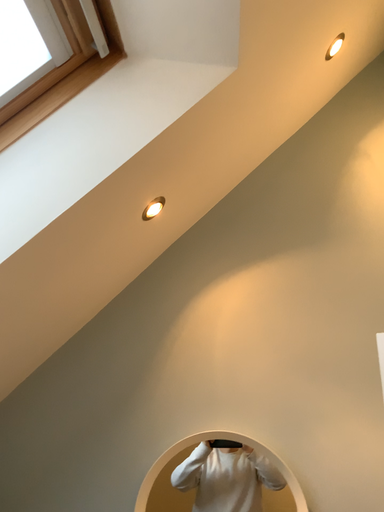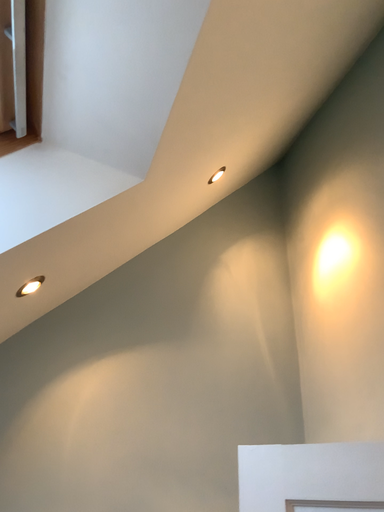
Question: How did the camera likely rotate when shooting the video?

Choices:
 (A) rotated upward
 (B) rotated downward

Answer: (A)